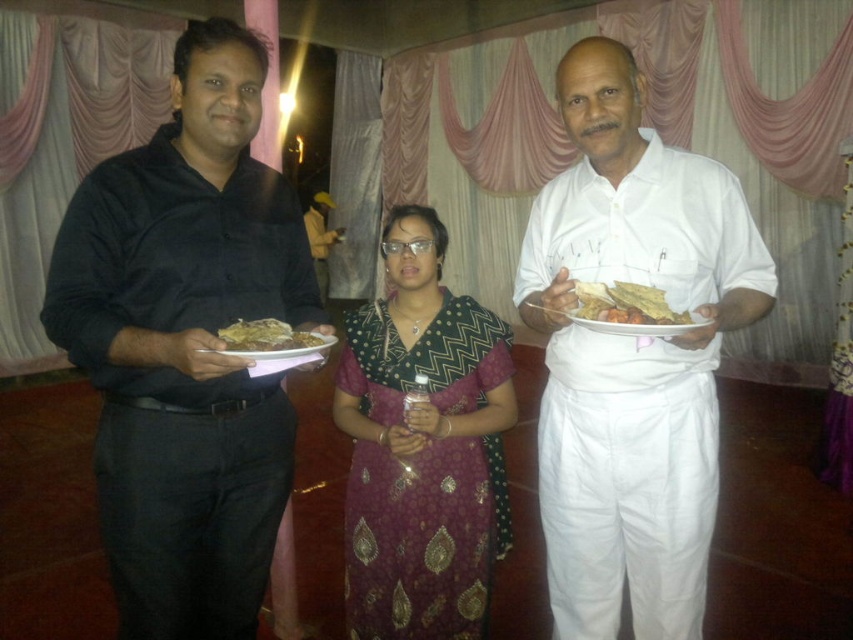
Measure the distance between white cotton shirt at center and yellow fabric jacket at center.

white cotton shirt at center is 6.57 meters away from yellow fabric jacket at center.

Is point (602, 604) less distant than point (328, 193)?

Yes, point (602, 604) is in front of point (328, 193).

Locate an element on the screen. white cotton shirt at center is located at coordinates (631, 356).

Can you confirm if black matte shirt at left is taller than white cotton shirt at center?

No.

Which is behind, point (137, 428) or point (607, 358)?

Positioned behind is point (607, 358).

At what (x,y) coordinates should I click in order to perform the action: click on black matte shirt at left. Please return your answer as a coordinate pair (x, y). Looking at the image, I should click on (186, 346).

Is the position of dark purple silk saree at center less distant than that of matte brown bread at left?

That is False.

Who is positioned more to the right, dark purple silk saree at center or matte brown bread at left?

dark purple silk saree at center is more to the right.

This screenshot has height=640, width=853. In order to click on dark purple silk saree at center in this screenshot , I will do `click(422, 445)`.